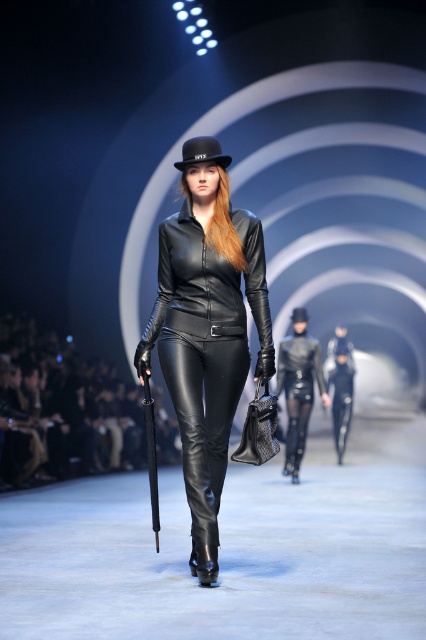
Is matte black leather pants at center to the right of black leather hat at center from the viewer's perspective?

Correct, you'll find matte black leather pants at center to the right of black leather hat at center.

Measure the distance between point (302, 369) and camera.

A distance of 29.79 feet exists between point (302, 369) and camera.

What do you see at coordinates (299, 390) in the screenshot?
I see `matte black leather pants at center` at bounding box center [299, 390].

Where is `matte black leather pants at center`? Image resolution: width=426 pixels, height=640 pixels. matte black leather pants at center is located at coordinates (299, 390).

Which of these two, black leather fedora at center or black leather hat at center, stands shorter?

Standing shorter between the two is black leather hat at center.

Can you confirm if black leather fedora at center is smaller than black leather hat at center?

Incorrect, black leather fedora at center is not smaller in size than black leather hat at center.

Is point (210, 161) farther from camera compared to point (299, 321)?

No, (210, 161) is closer to viewer.

Identify the location of black leather fedora at center. (201, 152).

How distant is black leather boot at center from black leather hat at center?

A distance of 5.05 meters exists between black leather boot at center and black leather hat at center.

Does black leather boot at center come in front of black leather hat at center?

Yes, it is.

Measure the distance between point (198, 573) and camera.

Point (198, 573) and camera are 4.31 meters apart from each other.

Find the location of `black leather boot at center`. black leather boot at center is located at coordinates (204, 563).